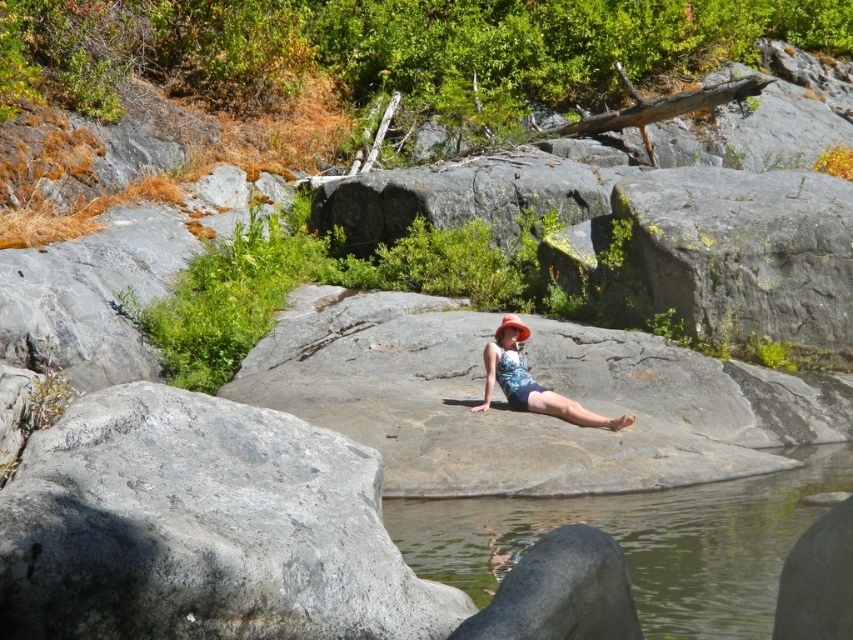
Question: Does clear water at center lie behind orange fabric hat at center?

Choices:
 (A) no
 (B) yes

Answer: (A)

Question: Which point is farther to the camera?

Choices:
 (A) (529, 372)
 (B) (288, 449)

Answer: (A)

Question: Observing the image, what is the correct spatial positioning of clear water at center in reference to matte floral swimsuit at center?

Choices:
 (A) above
 (B) below

Answer: (B)

Question: Which of these objects is positioned closest to the matte floral swimsuit at center?

Choices:
 (A) clear water at center
 (B) gray rough rock at center
 (C) orange fabric hat at center

Answer: (C)

Question: Observing the image, what is the correct spatial positioning of clear water at center in reference to matte floral swimsuit at center?

Choices:
 (A) above
 (B) below

Answer: (B)

Question: Among these points, which one is farthest from the camera?

Choices:
 (A) pyautogui.click(x=515, y=372)
 (B) pyautogui.click(x=97, y=424)

Answer: (A)